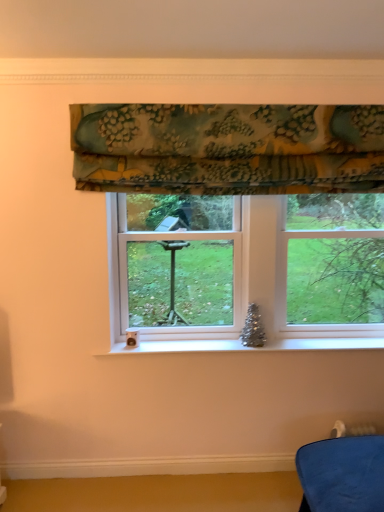
Question: Is floral fabric valance at upper center turned away from clear glass window at center?

Choices:
 (A) no
 (B) yes

Answer: (A)

Question: From the image's perspective, would you say floral fabric valance at upper center is shown under clear glass window at center?

Choices:
 (A) yes
 (B) no

Answer: (B)

Question: Is floral fabric valance at upper center taller than clear glass window at center?

Choices:
 (A) no
 (B) yes

Answer: (A)

Question: From the image's perspective, is floral fabric valance at upper center on clear glass window at center?

Choices:
 (A) yes
 (B) no

Answer: (A)

Question: Considering the relative sizes of floral fabric valance at upper center and clear glass window at center in the image provided, is floral fabric valance at upper center wider than clear glass window at center?

Choices:
 (A) no
 (B) yes

Answer: (A)

Question: Can you confirm if floral fabric valance at upper center is thinner than clear glass window at center?

Choices:
 (A) no
 (B) yes

Answer: (B)

Question: Is clear glass window at center outside floral fabric valance at upper center?

Choices:
 (A) yes
 (B) no

Answer: (A)

Question: Considering the relative positions of clear glass window at center and floral fabric valance at upper center in the image provided, is clear glass window at center to the left of floral fabric valance at upper center from the viewer's perspective?

Choices:
 (A) no
 (B) yes

Answer: (A)

Question: From a real-world perspective, is clear glass window at center physically below floral fabric valance at upper center?

Choices:
 (A) no
 (B) yes

Answer: (B)

Question: Is clear glass window at center closer to the viewer compared to floral fabric valance at upper center?

Choices:
 (A) no
 (B) yes

Answer: (A)

Question: Can you confirm if clear glass window at center is smaller than floral fabric valance at upper center?

Choices:
 (A) yes
 (B) no

Answer: (B)

Question: Could you tell me if clear glass window at center is turned towards floral fabric valance at upper center?

Choices:
 (A) no
 (B) yes

Answer: (A)

Question: From the image's perspective, is floral fabric valance at upper center above or below clear glass window at center?

Choices:
 (A) below
 (B) above

Answer: (B)